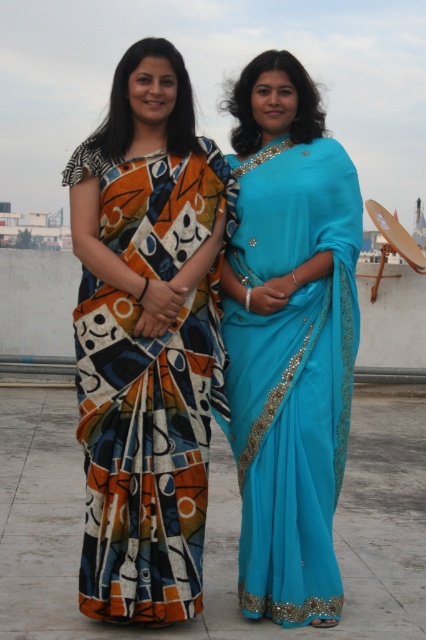
You are a fashion designer observing two women wearing different saris. The first woman wears the abstract print fabric sari at left, and the second woman wears the turquoise satin saree at center. You need to determine which sari has a narrower width. Which one is narrower?

The turquoise satin saree at center has a narrower width than the abstract print fabric sari at left.